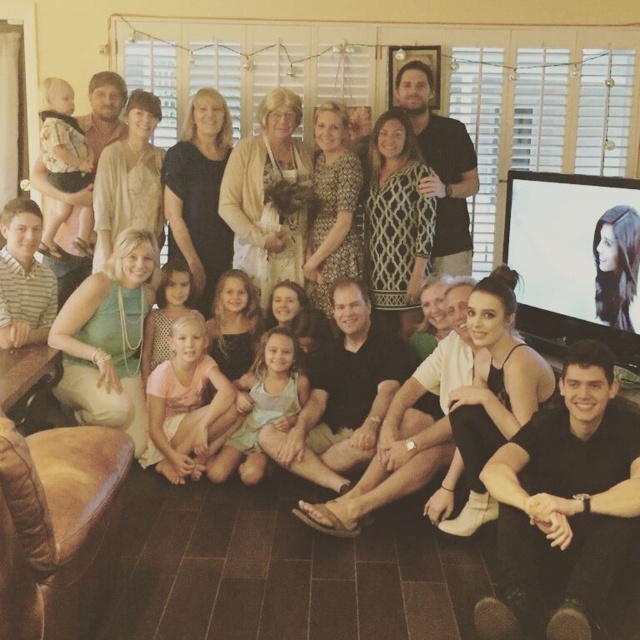
Which is in front, point (269, 420) or point (147, 333)?

Point (269, 420) is more forward.

This screenshot has width=640, height=640. What do you see at coordinates (262, 406) in the screenshot? I see `light blue fabric dress at center` at bounding box center [262, 406].

Between point (214, 458) and point (163, 360), which one is positioned behind?

The point (163, 360) is more distant.

Find the location of a particular element. The width and height of the screenshot is (640, 640). light blue fabric dress at center is located at coordinates [x=262, y=406].

Can you confirm if pink cotton shirt at center is positioned to the left of light blue fabric dress at center?

Indeed, pink cotton shirt at center is positioned on the left side of light blue fabric dress at center.

Is pink cotton shirt at center thinner than light blue fabric dress at center?

Indeed, pink cotton shirt at center has a lesser width compared to light blue fabric dress at center.

Does point (225, 387) lie in front of point (291, 346)?

Yes, point (225, 387) is closer to viewer.

Locate an element on the screen. This screenshot has height=640, width=640. pink cotton shirt at center is located at coordinates (188, 403).

Between point (204, 420) and point (67, 164), which one is positioned in front?

Point (204, 420) is in front.

Is pink cotton shirt at center below light brown fabric baby carrier at left?

Correct, pink cotton shirt at center is located below light brown fabric baby carrier at left.

Does point (173, 452) come closer to viewer compared to point (84, 230)?

Yes, it is in front of point (84, 230).

Locate an element on the screen. The image size is (640, 640). pink cotton shirt at center is located at coordinates (188, 403).